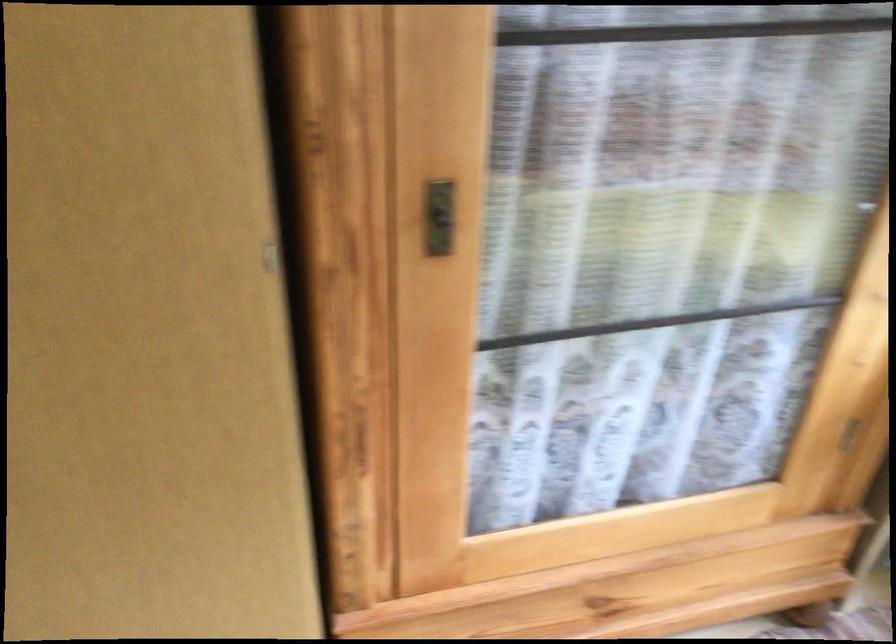
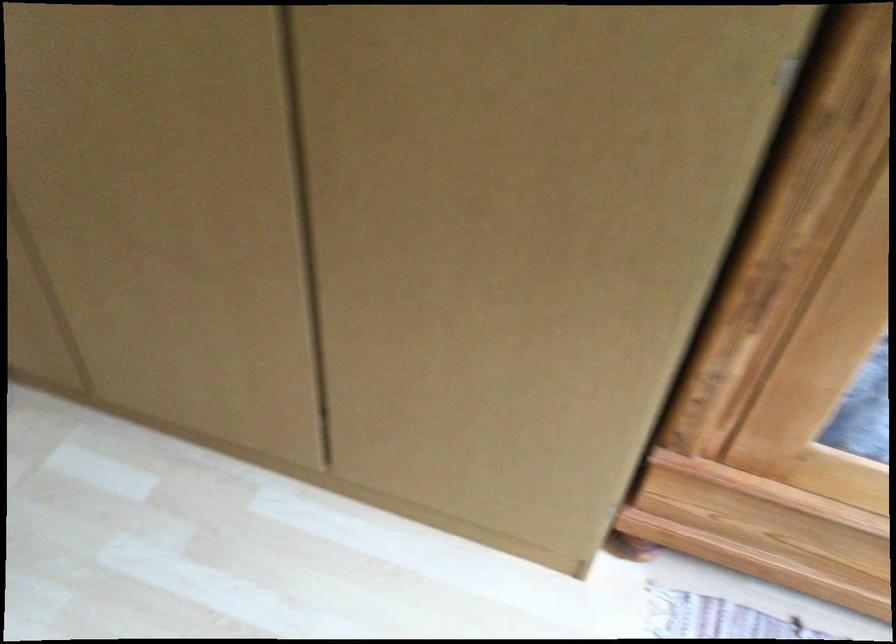
Question: How did the camera likely rotate?

Choices:
 (A) Left
 (B) Right
 (C) Up
 (D) Down

Answer: (A)